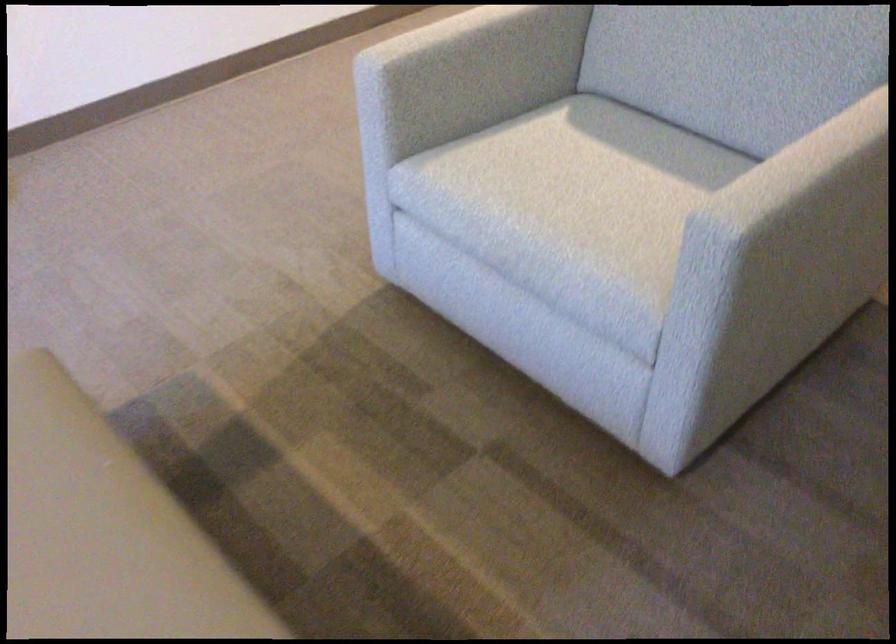
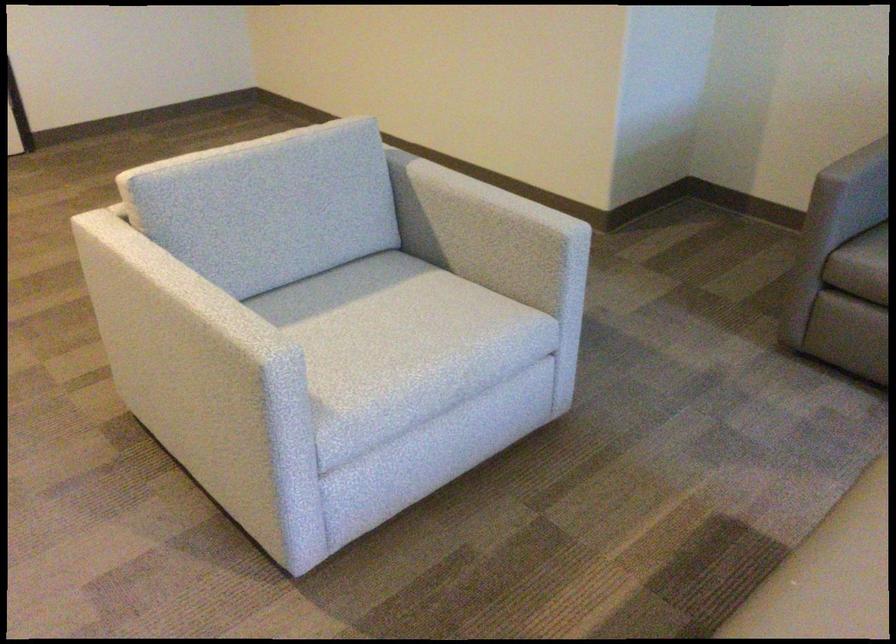
The point at (574,216) is marked in the first image. Where is the corresponding point in the second image?

(427, 333)